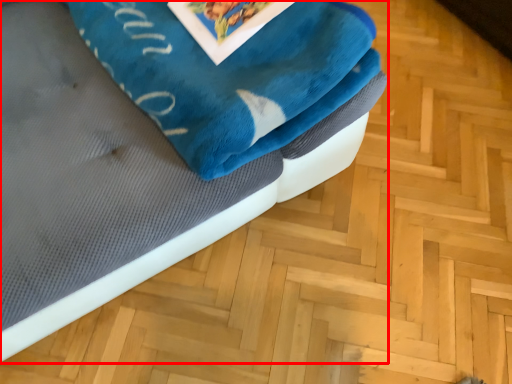
Question: Considering the relative positions of furniture (annotated by the red box) and bath towel in the image provided, where is furniture (annotated by the red box) located with respect to the staircase?

Choices:
 (A) right
 (B) left

Answer: (B)